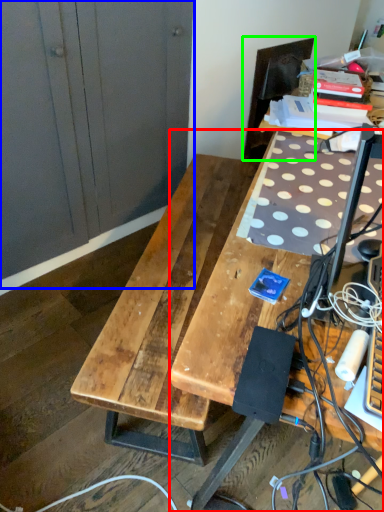
Question: Based on their relative distances, which object is nearer to desk (highlighted by a red box)? Choose from dresser (highlighted by a blue box) and swivel chair (highlighted by a green box).

Choices:
 (A) dresser
 (B) swivel chair

Answer: (A)